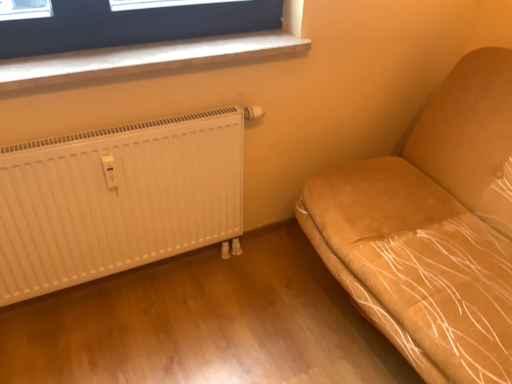
Locate an element on the screen. The width and height of the screenshot is (512, 384). free space underneath white ribbed radiator at lower left (from a real-world perspective) is located at coordinates (136, 281).